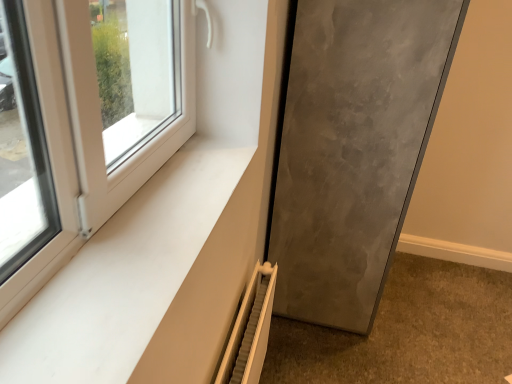
What do you see at coordinates (123, 276) in the screenshot? I see `white matte window sill at lower left` at bounding box center [123, 276].

Describe the element at coordinates (353, 149) in the screenshot. I see `matte gray door at lower right` at that location.

In order to click on white matte window sill at lower left in this screenshot , I will do `click(123, 276)`.

Is white matte window sill at lower left smaller than matte gray door at lower right?

Indeed, white matte window sill at lower left has a smaller size compared to matte gray door at lower right.

The width and height of the screenshot is (512, 384). Identify the location of door above the white matte window sill at lower left (from the image's perspective). (353, 149).

Is white matte window sill at lower left turned away from matte gray door at lower right?

No, white matte window sill at lower left is not facing the opposite direction of matte gray door at lower right.

Is white textured radiator at lower center looking in the opposite direction of matte gray door at lower right?

No, matte gray door at lower right is not at the back of white textured radiator at lower center.

Is white textured radiator at lower center positioned beyond the bounds of matte gray door at lower right?

Yes, white textured radiator at lower center is not within matte gray door at lower right.

Considering the sizes of objects matte gray door at lower right and white textured radiator at lower center in the image provided, who is bigger, matte gray door at lower right or white textured radiator at lower center?

With larger size is matte gray door at lower right.

Which object is thinner, matte gray door at lower right or white textured radiator at lower center?

white textured radiator at lower center.

Is matte gray door at lower right positioned with its back to white textured radiator at lower center?

No, matte gray door at lower right is not facing the opposite direction of white textured radiator at lower center.

Based on the photo, from the image's perspective, between matte gray door at lower right and white matte window sill at lower left, who is located below?

white matte window sill at lower left.

Is point (422, 8) positioned after point (69, 336)?

Yes, it is behind point (69, 336).

Consider the image. Considering the sizes of objects matte gray door at lower right and white matte window sill at lower left in the image provided, who is thinner, matte gray door at lower right or white matte window sill at lower left?

white matte window sill at lower left.

Where is `window sill on the left of the white textured radiator at lower center`? window sill on the left of the white textured radiator at lower center is located at coordinates (123, 276).

From a real-world perspective, which is physically below, white matte window sill at lower left or white textured radiator at lower center?

In real-world perspective, white textured radiator at lower center is lower.

What's the angular difference between white matte window sill at lower left and white textured radiator at lower center's facing directions?

The facing directions of white matte window sill at lower left and white textured radiator at lower center are 0.312 degrees apart.

Is white textured radiator at lower center next to white matte window sill at lower left?

white textured radiator at lower center and white matte window sill at lower left are clearly separated.

Based on the photo, is white textured radiator at lower center closer to the viewer compared to white matte window sill at lower left?

No, white textured radiator at lower center is further to the viewer.

From the image's perspective, between white textured radiator at lower center and white matte window sill at lower left, which one is located above?

white matte window sill at lower left, from the image's perspective.

Where is `door lying behind the white matte window sill at lower left`? door lying behind the white matte window sill at lower left is located at coordinates (353, 149).

Locate an element on the screen. The height and width of the screenshot is (384, 512). door on the right of white textured radiator at lower center is located at coordinates (353, 149).

Which object lies further to the anchor point white textured radiator at lower center, matte gray door at lower right or white matte window sill at lower left?

matte gray door at lower right is positioned further to the anchor white textured radiator at lower center.

From the image, which object appears to be nearer to white textured radiator at lower center, white matte window sill at lower left or matte gray door at lower right?

white matte window sill at lower left is closer to white textured radiator at lower center.

When comparing their distances from matte gray door at lower right, does white matte window sill at lower left or white textured radiator at lower center seem closer?

Among the two, white textured radiator at lower center is located nearer to matte gray door at lower right.

Looking at the image, which one is located closer to matte gray door at lower right, white textured radiator at lower center or white matte window sill at lower left?

white textured radiator at lower center.

Which object lies further to the anchor point white matte window sill at lower left, matte gray door at lower right or white textured radiator at lower center?

Based on the image, matte gray door at lower right appears to be further to white matte window sill at lower left.

Estimate the real-world distances between objects in this image. Which object is closer to white matte window sill at lower left, white textured radiator at lower center or matte gray door at lower right?

Based on the image, white textured radiator at lower center appears to be nearer to white matte window sill at lower left.

You are a GUI agent. You are given a task and a screenshot of the screen. Output one action in this format:
    pyautogui.click(x=<x>, y=<y>)
    Task: Click on the window sill between matte gray door at lower right and white textured radiator at lower center vertically
    
    Given the screenshot: What is the action you would take?
    pyautogui.click(x=123, y=276)